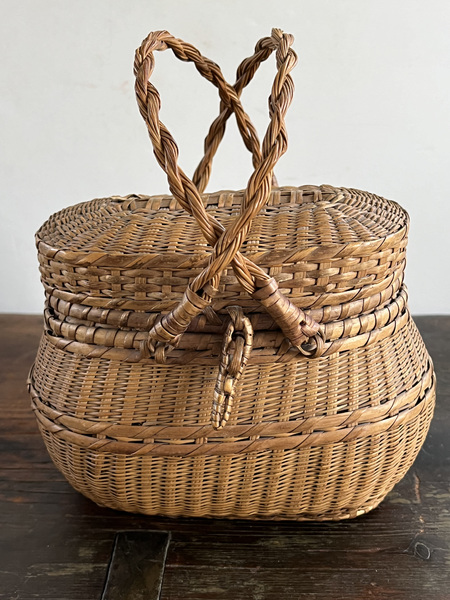
Identify the location of sides of basket bottom. (366, 508), (93, 503).